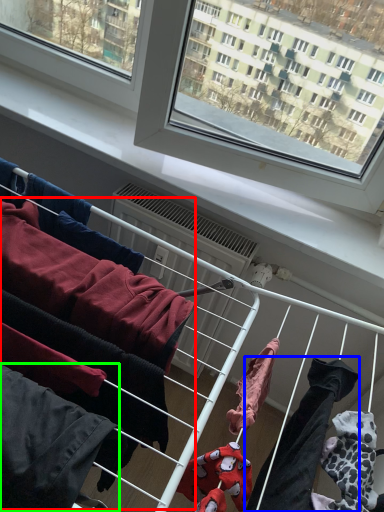
Question: Based on their relative distances, which object is nearer to clothing (highlighted by a red box)? Choose from clothing (highlighted by a blue box) and clothing (highlighted by a green box).

Choices:
 (A) clothing
 (B) clothing

Answer: (B)